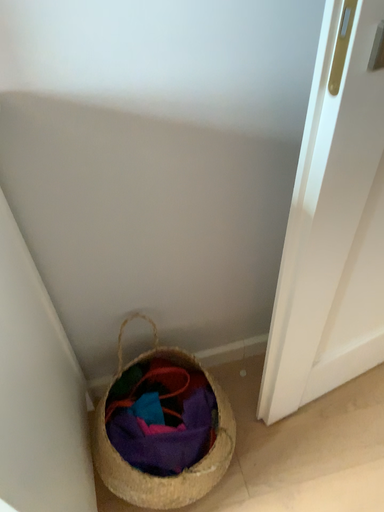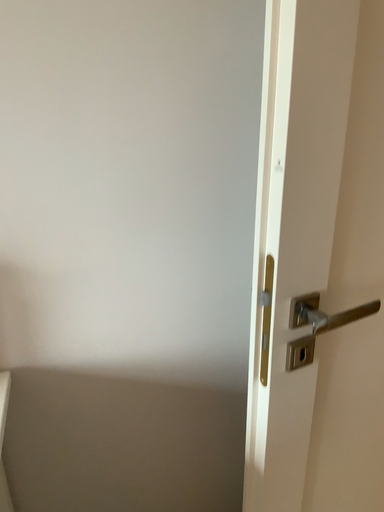
Question: Which way did the camera rotate in the video?

Choices:
 (A) rotated downward
 (B) rotated upward

Answer: (B)